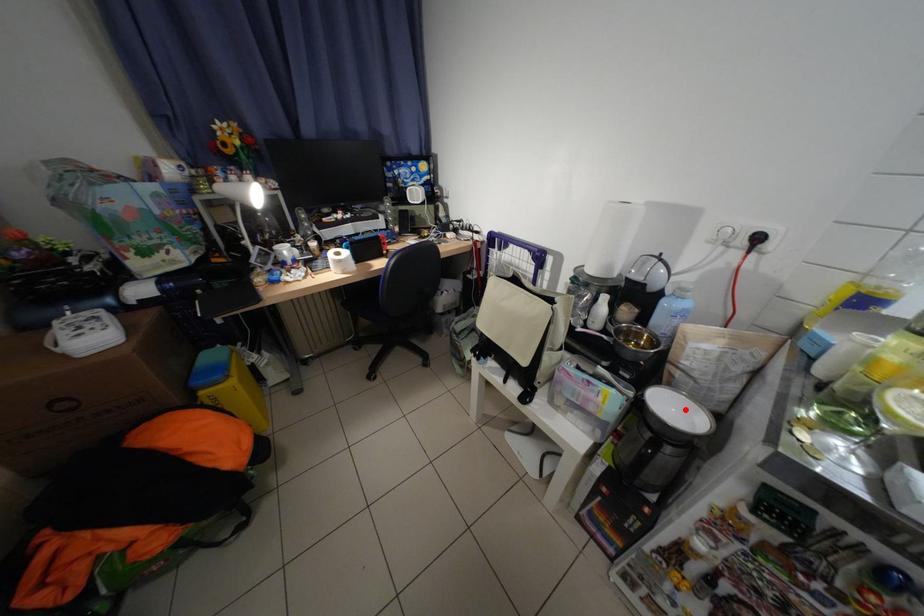
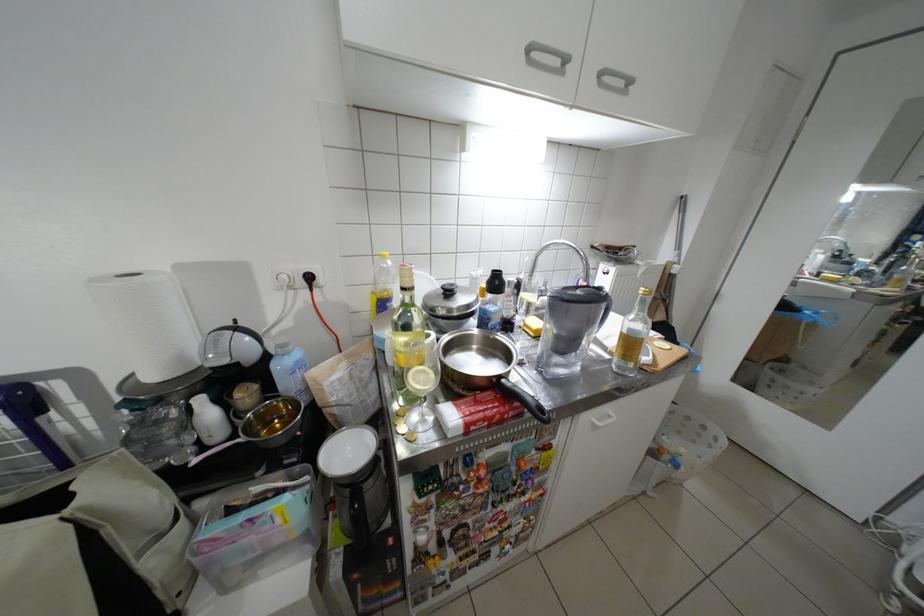
The point at the highlighted location is marked in the first image. Where is the corresponding point in the second image?

(359, 452)